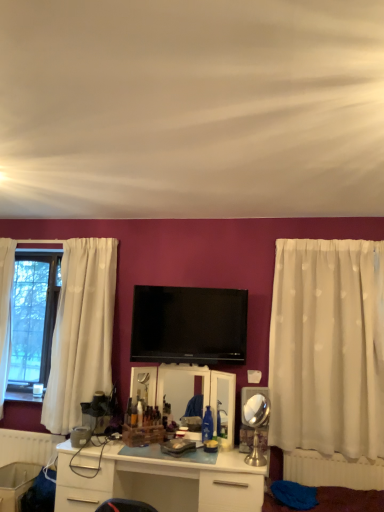
What is the approximate width of white sheer curtain at right?

It is 7.37 inches.

What do you see at coordinates (27, 446) in the screenshot? The height and width of the screenshot is (512, 384). I see `white plastic radiator at lower left, positioned as the 2th radiator in front-to-back order` at bounding box center [27, 446].

What do you see at coordinates (158, 480) in the screenshot? I see `white glossy desk at center` at bounding box center [158, 480].

In order to click on white plastic radiator at lower right, the 1th radiator viewed from the front in this screenshot , I will do `click(332, 470)`.

Based on their positions, is white plastic radiator at lower right, marked as the 2th radiator in a left-to-right arrangement, located to the left or right of white plastic radiator at lower left, positioned as the 2th radiator in front-to-back order?

From the image, it's evident that white plastic radiator at lower right, marked as the 2th radiator in a left-to-right arrangement, is to the right of white plastic radiator at lower left, positioned as the 2th radiator in front-to-back order.

Is white plastic radiator at lower right, which is the second radiator from back to front, beside white plastic radiator at lower left, positioned as the 2th radiator in front-to-back order?

No.

How different are the orientations of white plastic radiator at lower right, the 1th radiator viewed from the front, and white plastic radiator at lower left, the 1th radiator from the left, in degrees?

There is a 0.671-degree angle between the facing directions of white plastic radiator at lower right, the 1th radiator viewed from the front, and white plastic radiator at lower left, the 1th radiator from the left.

Considering the points (64, 470) and (152, 323), which point is behind, point (64, 470) or point (152, 323)?

Positioned behind is point (152, 323).

Would you say white glossy desk at center is a long distance from flat screen tv at center?

No, white glossy desk at center is not far from flat screen tv at center.

How much distance is there between white glossy desk at center and flat screen tv at center?

white glossy desk at center is 29.87 inches from flat screen tv at center.

From their relative heights in the image, would you say white glossy desk at center is taller or shorter than flat screen tv at center?

white glossy desk at center is taller than flat screen tv at center.

Considering the relative sizes of white plastic radiator at lower right, marked as the 2th radiator in a left-to-right arrangement, and white glossy desk at center in the image provided, is white plastic radiator at lower right, marked as the 2th radiator in a left-to-right arrangement, thinner than white glossy desk at center?

Correct, the width of white plastic radiator at lower right, marked as the 2th radiator in a left-to-right arrangement, is less than that of white glossy desk at center.

From the image's perspective, which one is positioned lower, white plastic radiator at lower right, marked as the 2th radiator in a left-to-right arrangement, or white glossy desk at center?

white glossy desk at center, from the image's perspective.

Is white glossy desk at center at the back of white plastic radiator at lower right, arranged as the first radiator when viewed from the right?

No.

Where is `the 2nd radiator above the white glossy desk at center (from the image's perspective)`? The height and width of the screenshot is (512, 384). the 2nd radiator above the white glossy desk at center (from the image's perspective) is located at coordinates (332, 470).

From a real-world perspective, between white glossy desk at center and white plastic radiator at lower right, which is the second radiator from back to front, who is vertically higher?

white plastic radiator at lower right, which is the second radiator from back to front.

Is white glossy desk at center not near white plastic radiator at lower right, which is the second radiator from back to front?

No.

From the image's perspective, which one is positioned lower, white glossy desk at center or white plastic radiator at lower right, marked as the 2th radiator in a left-to-right arrangement?

white glossy desk at center.

Is white sheer curtain at right outside of white glossy desk at center?

white sheer curtain at right lies outside white glossy desk at center's area.

Between white sheer curtain at right and white glossy desk at center, which one has smaller width?

white sheer curtain at right is thinner.

Can you tell me how much white sheer curtain at right and white glossy desk at center differ in facing direction?

There is a 1.67-degree angle between the facing directions of white sheer curtain at right and white glossy desk at center.

Could you tell me if white sheer curtain at right is turned towards white glossy desk at center?

No, white sheer curtain at right is not aimed at white glossy desk at center.

From a real-world perspective, is white sheer curtain at right physically above white plastic radiator at lower right, arranged as the first radiator when viewed from the right?

Indeed, from a real-world perspective, white sheer curtain at right stands above white plastic radiator at lower right, arranged as the first radiator when viewed from the right.

From their relative heights in the image, would you say white sheer curtain at right is taller or shorter than white plastic radiator at lower right, which is the second radiator from back to front?

Clearly, white sheer curtain at right is taller compared to white plastic radiator at lower right, which is the second radiator from back to front.

Does point (347, 280) come behind point (379, 468)?

That is True.

Which of these two, flat screen tv at center or white sheer curtain at right, is thinner?

Thinner between the two is flat screen tv at center.

Is flat screen tv at center positioned with its back to white sheer curtain at right?

flat screen tv at center does not have its back to white sheer curtain at right.

From the image's perspective, is flat screen tv at center located beneath white sheer curtain at right?

No.

This screenshot has height=512, width=384. Find the location of `radiator lying on the left of white plastic radiator at lower right, marked as the 2th radiator in a left-to-right arrangement`. radiator lying on the left of white plastic radiator at lower right, marked as the 2th radiator in a left-to-right arrangement is located at coordinates (27, 446).

Identify the location of desk lying in front of the flat screen tv at center. (158, 480).

From the image, which object appears to be nearer to white sheer curtain at right, white plastic radiator at lower right, arranged as the first radiator when viewed from the right, or white glossy desk at center?

The object closer to white sheer curtain at right is white plastic radiator at lower right, arranged as the first radiator when viewed from the right.

Based on their spatial positions, is white plastic radiator at lower left, the 1th radiator from the left, or white glossy desk at center closer to white sheer curtain at right?

white glossy desk at center is closer to white sheer curtain at right.

When comparing their distances from white sheer curtain at right, does white plastic radiator at lower right, which is the second radiator from back to front, or flat screen tv at center seem further?

The object further to white sheer curtain at right is flat screen tv at center.

When comparing their distances from flat screen tv at center, does white plastic radiator at lower right, which is the second radiator from back to front, or white sheer curtain at right seem further?

Among the two, white plastic radiator at lower right, which is the second radiator from back to front, is located further to flat screen tv at center.

Estimate the real-world distances between objects in this image. Which object is closer to flat screen tv at center, white plastic radiator at lower right, the 1th radiator viewed from the front, or white glossy desk at center?

Among the two, white glossy desk at center is located nearer to flat screen tv at center.

Estimate the real-world distances between objects in this image. Which object is closer to white glossy desk at center, white plastic radiator at lower right, arranged as the first radiator when viewed from the right, or white plastic radiator at lower left, positioned as the second radiator in right-to-left order?

white plastic radiator at lower right, arranged as the first radiator when viewed from the right, is closer to white glossy desk at center.

Based on their spatial positions, is white sheer curtain at right or white plastic radiator at lower right, the 1th radiator viewed from the front, closer to white glossy desk at center?

Among the two, white plastic radiator at lower right, the 1th radiator viewed from the front, is located nearer to white glossy desk at center.

Based on their spatial positions, is white glossy desk at center or flat screen tv at center further from white sheer curtain at right?

The object further to white sheer curtain at right is white glossy desk at center.

I want to click on radiator located between white glossy desk at center and white sheer curtain at right in the left-right direction, so [332, 470].

The width and height of the screenshot is (384, 512). I want to click on desk between white plastic radiator at lower left, positioned as the 2th radiator in front-to-back order, and white sheer curtain at right from left to right, so click(158, 480).

Find the location of a particular element. The height and width of the screenshot is (512, 384). curtain between flat screen tv at center and white glossy desk at center in the up-down direction is located at coordinates (328, 347).

Locate an element on the screen. Image resolution: width=384 pixels, height=512 pixels. radiator between flat screen tv at center and white sheer curtain at right in the horizontal direction is located at coordinates (332, 470).